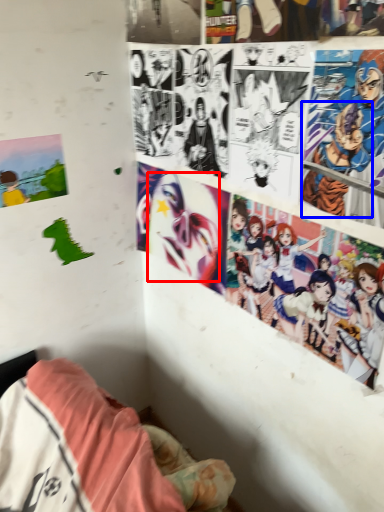
Question: Which point is further to the camera, human face (highlighted by a red box) or person (highlighted by a blue box)?

Choices:
 (A) human face
 (B) person

Answer: (A)